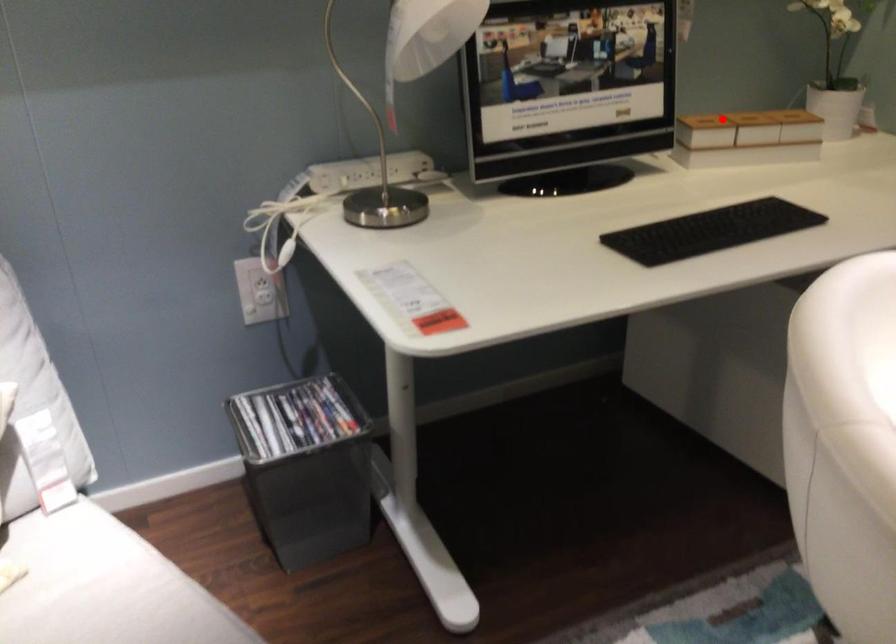
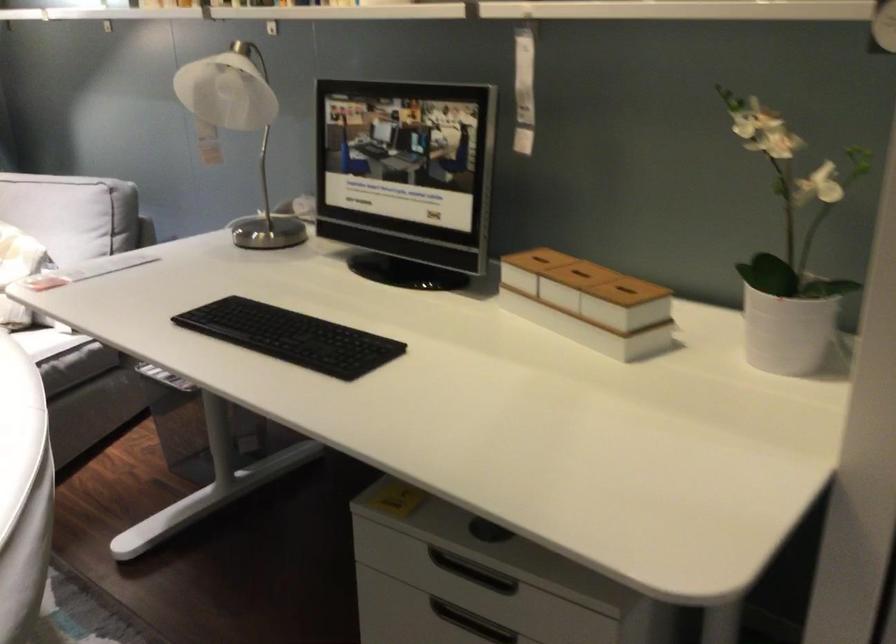
Where in the second image is the point corresponding to the highlighted location from the first image?

(537, 259)